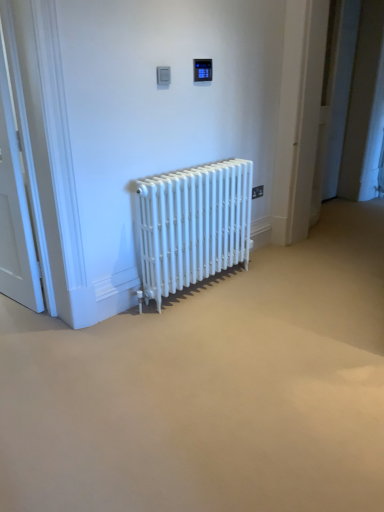
Question: Is white wooden door at left directly adjacent to white matte radiator at center?

Choices:
 (A) no
 (B) yes

Answer: (A)

Question: Is white wooden door at left turned away from white matte radiator at center?

Choices:
 (A) yes
 (B) no

Answer: (B)

Question: Can you confirm if white wooden door at left is thinner than white matte radiator at center?

Choices:
 (A) yes
 (B) no

Answer: (A)

Question: Can you confirm if white wooden door at left is shorter than white matte radiator at center?

Choices:
 (A) no
 (B) yes

Answer: (A)

Question: Does white wooden door at left lie behind white matte radiator at center?

Choices:
 (A) yes
 (B) no

Answer: (B)

Question: Considering their positions, is black plastic electric outlet at upper center located in front of or behind white wooden door at left?

Choices:
 (A) behind
 (B) front

Answer: (A)

Question: Does point (254, 196) appear closer or farther from the camera than point (4, 93)?

Choices:
 (A) closer
 (B) farther

Answer: (B)

Question: Considering the positions of black plastic electric outlet at upper center and white wooden door at left in the image, is black plastic electric outlet at upper center taller or shorter than white wooden door at left?

Choices:
 (A) short
 (B) tall

Answer: (A)

Question: In terms of width, does black plastic electric outlet at upper center look wider or thinner when compared to white wooden door at left?

Choices:
 (A) wide
 (B) thin

Answer: (B)

Question: Is point (139, 202) closer or farther from the camera than point (253, 197)?

Choices:
 (A) closer
 (B) farther

Answer: (A)

Question: Is white matte radiator at center bigger or smaller than black plastic electric outlet at upper center?

Choices:
 (A) small
 (B) big

Answer: (B)

Question: From a real-world perspective, is white matte radiator at center above or below black plastic electric outlet at upper center?

Choices:
 (A) below
 (B) above

Answer: (A)

Question: From the image's perspective, is white matte radiator at center positioned above or below black plastic electric outlet at upper center?

Choices:
 (A) below
 (B) above

Answer: (A)

Question: Looking at their shapes, would you say white wooden door at left is wider or thinner than black plastic electric outlet at upper center?

Choices:
 (A) wide
 (B) thin

Answer: (A)

Question: Does point (21, 206) appear closer or farther from the camera than point (258, 196)?

Choices:
 (A) farther
 (B) closer

Answer: (B)